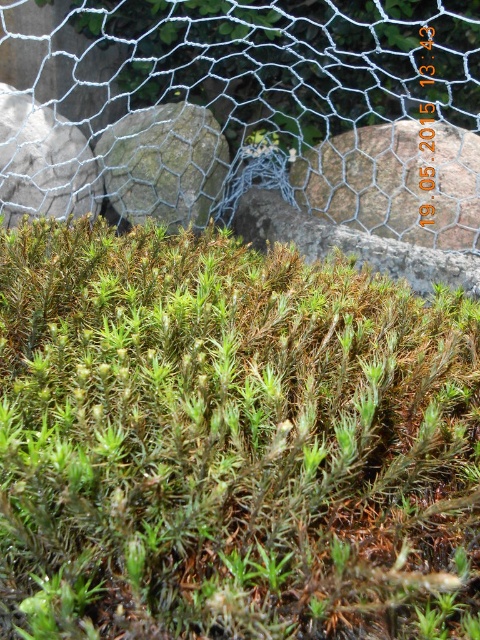
Question: Is gray rough stone at center below gray rough stone at upper left?

Choices:
 (A) no
 (B) yes

Answer: (B)

Question: Is green fuzzy moss at center above gray rock at center?

Choices:
 (A) yes
 (B) no

Answer: (B)

Question: Does green fuzzy moss at center appear under wire mesh at upper center?

Choices:
 (A) yes
 (B) no

Answer: (A)

Question: Which object is closer to the camera taking this photo?

Choices:
 (A) gray rock at center
 (B) green fuzzy moss at center

Answer: (B)

Question: Which point is farther from the camera taking this photo?

Choices:
 (A) (402, 118)
 (B) (0, 330)
 (C) (38, 145)

Answer: (A)

Question: Which of the following is the closest to the observer?

Choices:
 (A) (469, 128)
 (B) (428, 172)
 (C) (151, 452)
 (D) (60, 179)

Answer: (C)